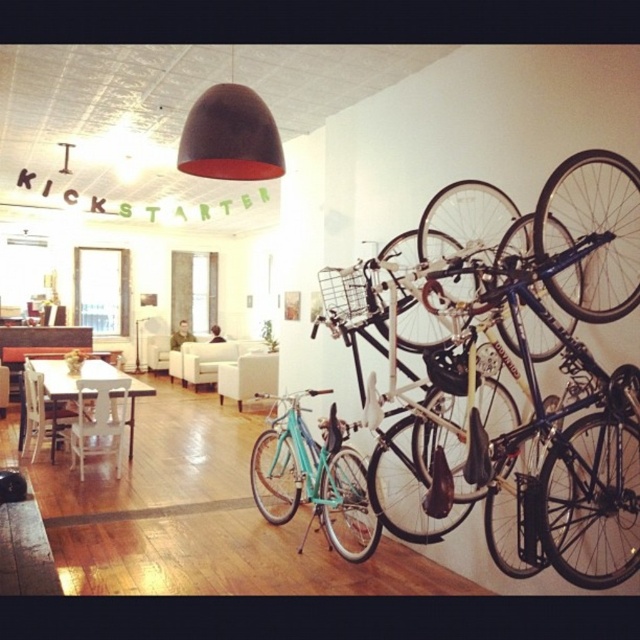
Between teal matte bicycle at center and white wooden table at center, which one is positioned higher?

white wooden table at center

Locate an element on the screen. The image size is (640, 640). teal matte bicycle at center is located at coordinates (314, 476).

Between point (467, 429) and point (269, 490), which one is positioned in front?

Positioned in front is point (467, 429).

Between teal matte bicycle at right and teal matte bicycle at center, which one appears on the right side from the viewer's perspective?

teal matte bicycle at right

Identify the location of teal matte bicycle at right. (518, 376).

Between white wood chair at lower left and white wooden table at center, which one is positioned higher?

Positioned higher is white wooden table at center.

Does white wood chair at lower left lie behind white wooden table at center?

No, white wood chair at lower left is closer to the viewer.

Is point (92, 413) positioned in front of point (74, 378)?

No.

Where is `white wood chair at lower left`? The height and width of the screenshot is (640, 640). white wood chair at lower left is located at coordinates (99, 420).